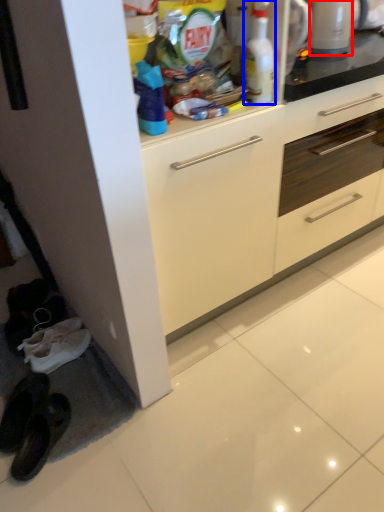
Question: Which object is further to the camera taking this photo, appliance (highlighted by a red box) or cleaning product (highlighted by a blue box)?

Choices:
 (A) appliance
 (B) cleaning product

Answer: (A)